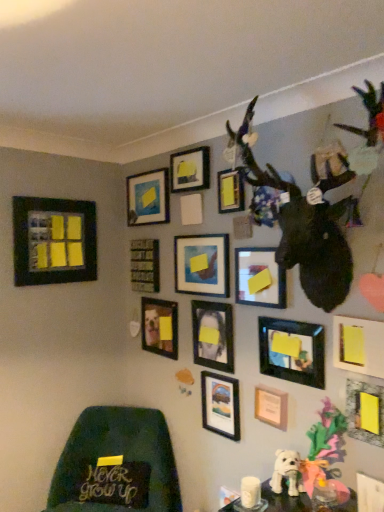
Question: Are matte black picture frame at center, marked as the sixth picture frame in a right-to-left arrangement, and matte wooden picture frame at center, acting as the 4th picture frame starting from the left, located far from each other?

Choices:
 (A) yes
 (B) no

Answer: (B)

Question: Is matte black picture frame at center, marked as the sixth picture frame in a right-to-left arrangement, at the left side of matte wooden picture frame at center, acting as the 4th picture frame starting from the left?

Choices:
 (A) no
 (B) yes

Answer: (A)

Question: Considering the relative sizes of matte black picture frame at center, marked as the sixth picture frame in a right-to-left arrangement, and matte wooden picture frame at center, acting as the 4th picture frame starting from the left, in the image provided, is matte black picture frame at center, marked as the sixth picture frame in a right-to-left arrangement, thinner than matte wooden picture frame at center, acting as the 4th picture frame starting from the left,?

Choices:
 (A) no
 (B) yes

Answer: (B)

Question: From a real-world perspective, is matte black picture frame at center, the tenth picture frame from the left, on matte wooden picture frame at center, acting as the 4th picture frame starting from the left?

Choices:
 (A) no
 (B) yes

Answer: (B)

Question: From the image's perspective, is matte black picture frame at center, the tenth picture frame from the left, above matte wooden picture frame at center, acting as the 4th picture frame starting from the left?

Choices:
 (A) yes
 (B) no

Answer: (A)

Question: From a real-world perspective, is matte black picture frame at lower right, positioned as the twelfth picture frame in left-to-right order, physically located above or below matte black picture frame at center, the eighth picture frame positioned from the left?

Choices:
 (A) below
 (B) above

Answer: (B)

Question: Is matte black picture frame at lower right, the fourth picture frame viewed from the right, in front of or behind matte black picture frame at center, the eighth picture frame positioned from the left, in the image?

Choices:
 (A) front
 (B) behind

Answer: (A)

Question: Is point (269, 368) closer or farther from the camera than point (201, 417)?

Choices:
 (A) farther
 (B) closer

Answer: (B)

Question: Would you say matte black picture frame at lower right, the fourth picture frame viewed from the right, is to the left or to the right of matte black picture frame at center, the eighth picture frame positioned from the left, in the picture?

Choices:
 (A) left
 (B) right

Answer: (B)

Question: Does point (150, 285) appear closer or farther from the camera than point (221, 205)?

Choices:
 (A) closer
 (B) farther

Answer: (B)

Question: Is black matte picture frame at center, the 2th picture frame viewed from the left, wider or thinner than matte black picture frame at upper center, the 7th picture frame positioned from the right?

Choices:
 (A) wide
 (B) thin

Answer: (A)

Question: Based on their positions, is black matte picture frame at center, the 14th picture frame when ordered from right to left, located to the left or right of matte black picture frame at upper center, the 7th picture frame positioned from the right?

Choices:
 (A) left
 (B) right

Answer: (A)

Question: Is black matte picture frame at center, the 14th picture frame when ordered from right to left, situated inside matte black picture frame at upper center, arranged as the 9th picture frame when viewed from the left, or outside?

Choices:
 (A) inside
 (B) outside

Answer: (B)

Question: From a real-world perspective, is white plush dog at lower center positioned above or below matte black picture frame at upper center, which appears as the thirteenth picture frame when viewed from the right?

Choices:
 (A) below
 (B) above

Answer: (A)

Question: Considering the positions of point (296, 489) and point (152, 179), is point (296, 489) closer or farther from the camera than point (152, 179)?

Choices:
 (A) farther
 (B) closer

Answer: (B)